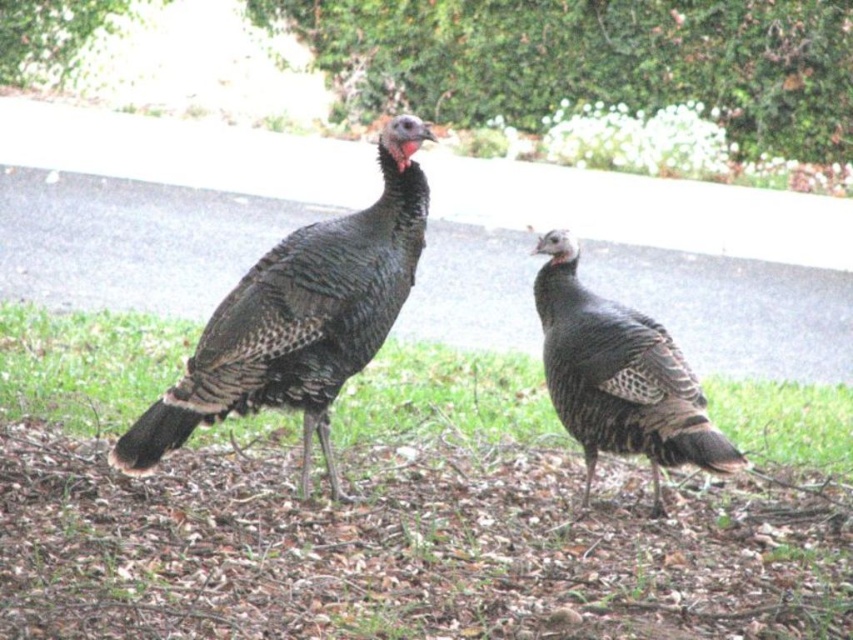
Question: Does green grass at center appear over speckled feathered turkey at center?

Choices:
 (A) no
 (B) yes

Answer: (B)

Question: Does green grass at center have a greater width compared to speckled feathered turkey at center?

Choices:
 (A) no
 (B) yes

Answer: (B)

Question: Considering the relative positions of green grass at center and dark brown feathers at center in the image provided, where is green grass at center located with respect to dark brown feathers at center?

Choices:
 (A) left
 (B) right

Answer: (A)

Question: Which point appears closest to the camera in this image?

Choices:
 (A) (294, 296)
 (B) (7, 392)
 (C) (630, 323)

Answer: (A)

Question: Which object is closer to the camera taking this photo?

Choices:
 (A) speckled feathered turkey at center
 (B) green grass at center

Answer: (A)

Question: Which point is farther to the camera?

Choices:
 (A) dark brown feathers at center
 (B) green grass at center

Answer: (B)